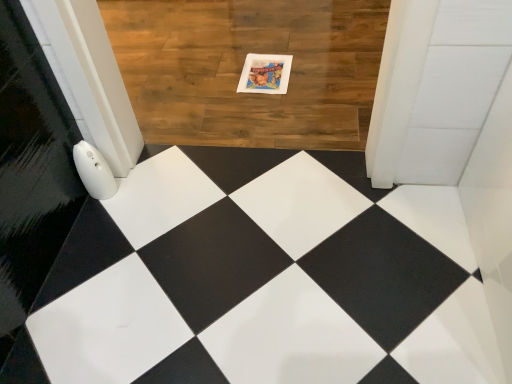
You are a GUI agent. You are given a task and a screenshot of the screen. Output one action in this format:
    pyautogui.click(x=<x>, y=<y>)
    Task: Click on the free location above wooden floor at center (from a real-world perspective)
    
    Given the screenshot: What is the action you would take?
    pyautogui.click(x=233, y=62)